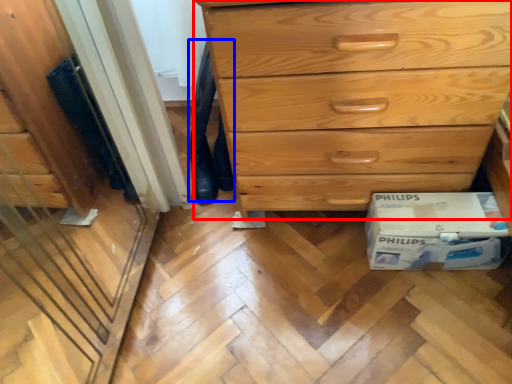
Question: Among these objects, which one is farthest to the camera, chest of drawers (highlighted by a red box) or jeans (highlighted by a blue box)?

Choices:
 (A) chest of drawers
 (B) jeans

Answer: (B)